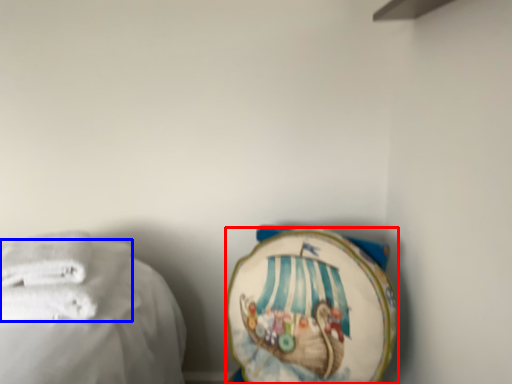
Question: Which object is closer to the camera taking this photo, towel (highlighted by a red box) or towel (highlighted by a blue box)?

Choices:
 (A) towel
 (B) towel

Answer: (B)